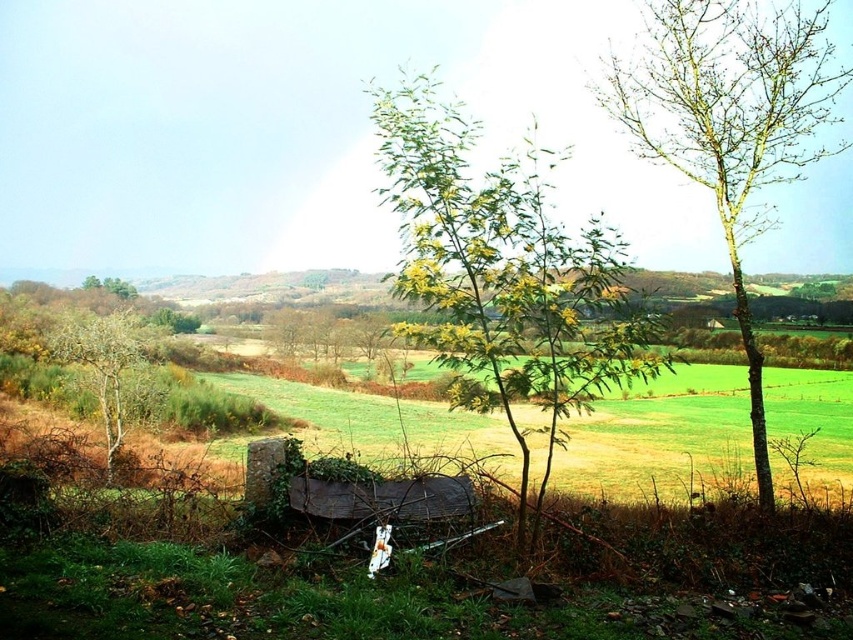
Does green leafy tree at right appear under smooth brown tree at left?

No, green leafy tree at right is not below smooth brown tree at left.

Does green leafy tree at right appear over smooth brown tree at left?

Correct, green leafy tree at right is located above smooth brown tree at left.

Is point (749, 364) less distant than point (122, 406)?

Yes, point (749, 364) is in front of point (122, 406).

The image size is (853, 640). I want to click on green leafy tree at right, so click(730, 124).

The image size is (853, 640). What are the coordinates of `green leafy tree at center` in the screenshot? It's located at (503, 276).

Can you confirm if green leafy tree at center is positioned to the left of green leafy tree at right?

Indeed, green leafy tree at center is positioned on the left side of green leafy tree at right.

Between point (486, 177) and point (643, 99), which one is positioned in front?

Point (486, 177) is more forward.

The height and width of the screenshot is (640, 853). In order to click on green leafy tree at center in this screenshot , I will do `click(503, 276)`.

This screenshot has height=640, width=853. In order to click on green leafy tree at center in this screenshot , I will do `click(503, 276)`.